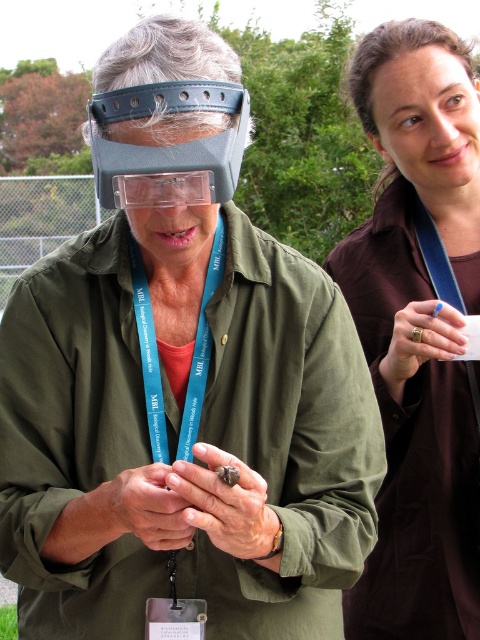
Looking at this image, can you confirm if brown matte shirt at upper right is taller than matte plastic goggles at center?

Yes, brown matte shirt at upper right is taller than matte plastic goggles at center.

In the scene shown: Is brown matte shirt at upper right bigger than matte plastic goggles at center?

Yes.

You are a GUI agent. You are given a task and a screenshot of the screen. Output one action in this format:
    pyautogui.click(x=<x>, y=<y>)
    Task: Click on the brown matte shirt at upper right
    
    Given the screenshot: What is the action you would take?
    pyautogui.click(x=419, y=330)

Which is below, matte plastic goggles at center or teal fabric lanyard at center?

teal fabric lanyard at center is below.

Who is more forward, (90, 140) or (133, 241)?

Positioned in front is point (90, 140).

The height and width of the screenshot is (640, 480). What do you see at coordinates (168, 147) in the screenshot?
I see `matte plastic goggles at center` at bounding box center [168, 147].

This screenshot has height=640, width=480. I want to click on matte plastic goggles at center, so 168,147.

This screenshot has height=640, width=480. What do you see at coordinates (419, 330) in the screenshot?
I see `brown matte shirt at upper right` at bounding box center [419, 330].

Is point (349, 88) positioned behind point (199, 314)?

That is True.

Where is `brown matte shirt at upper right`? The width and height of the screenshot is (480, 640). brown matte shirt at upper right is located at coordinates (419, 330).